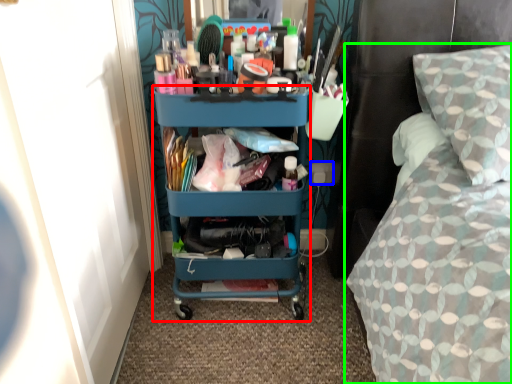
Question: Considering the real-world distances, which object is closest to desk (highlighted by a red box)? power outlet (highlighted by a blue box) or bed (highlighted by a green box).

Choices:
 (A) power outlet
 (B) bed

Answer: (B)